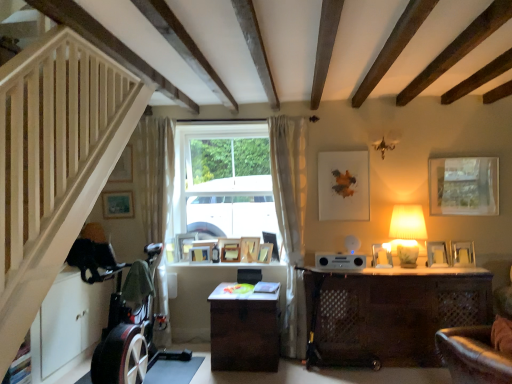
The image size is (512, 384). Find the location of `free space above brown woven table at center (from a real-world perspective)`. free space above brown woven table at center (from a real-world perspective) is located at coordinates (248, 289).